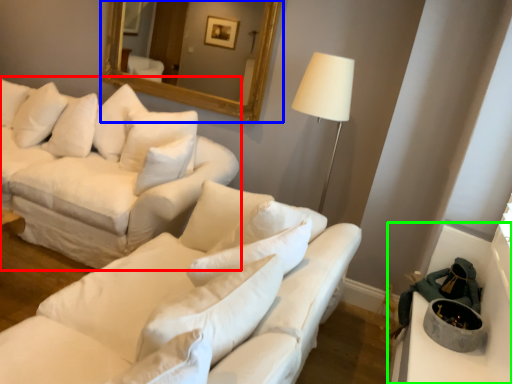
Question: Which object is positioned farthest from studio couch (highlighted by a red box)? Select from mirror (highlighted by a blue box) and table (highlighted by a green box).

Choices:
 (A) mirror
 (B) table

Answer: (B)